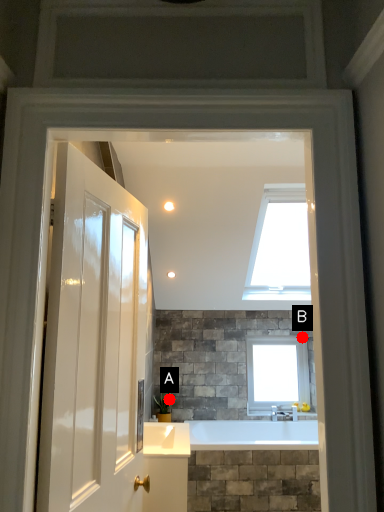
Question: Two points are circled on the image, labeled by A and B beside each circle. Which point is closer to the camera taking this photo?

Choices:
 (A) A is closer
 (B) B is closer

Answer: (A)